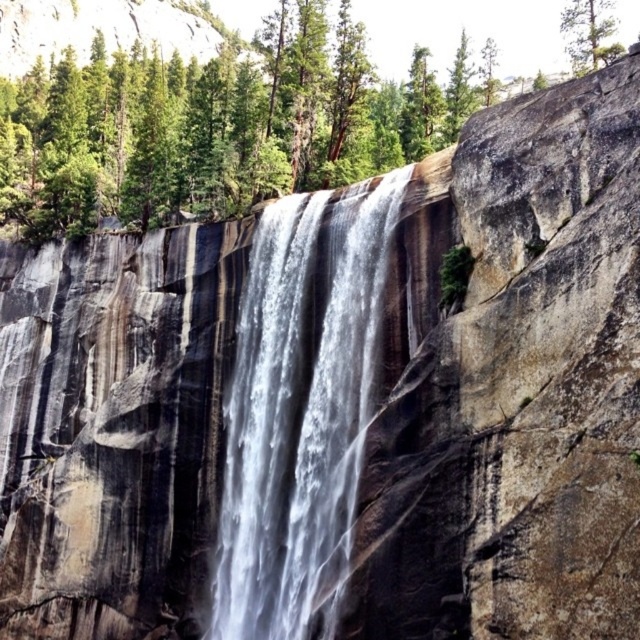
Is point (296, 531) positioned after point (572, 1)?

No, it is not.

Identify the location of white smooth waterfall at center. (301, 416).

Consider the image. Which is below, green leafy tree at center or white smooth waterfall at center?

white smooth waterfall at center

Can you confirm if green leafy tree at center is positioned above white smooth waterfall at center?

Yes, green leafy tree at center is above white smooth waterfall at center.

Between point (275, 132) and point (355, 384), which one is positioned behind?

The point (275, 132) is behind.

In order to click on green leafy tree at center in this screenshot , I will do coord(221,120).

Is green leafy tree at center above green matte tree at upper center?

No.

Measure the distance between point (8, 168) and camera.

Point (8, 168) is 112.16 meters away from camera.

This screenshot has width=640, height=640. I want to click on green leafy tree at center, so click(x=221, y=120).